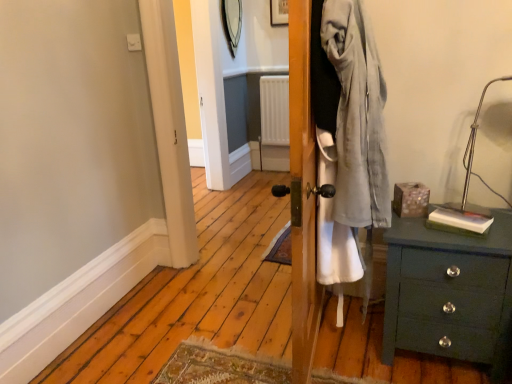
Question: Is wooden picture frame at upper center taller or shorter than metallic silver mirror at upper center?

Choices:
 (A) short
 (B) tall

Answer: (A)

Question: From a real-world perspective, is wooden picture frame at upper center physically located above or below metallic silver mirror at upper center?

Choices:
 (A) below
 (B) above

Answer: (B)

Question: Considering the real-world distances, which object is closest to the green wood chest of drawers at lower right?

Choices:
 (A) metallic silver table lamp at upper right
 (B) metallic silver mirror at upper center
 (C) wooden picture frame at upper center

Answer: (A)

Question: Which is farther from the metallic silver table lamp at upper right?

Choices:
 (A) green wood chest of drawers at lower right
 (B) wooden picture frame at upper center
 (C) metallic silver mirror at upper center

Answer: (B)